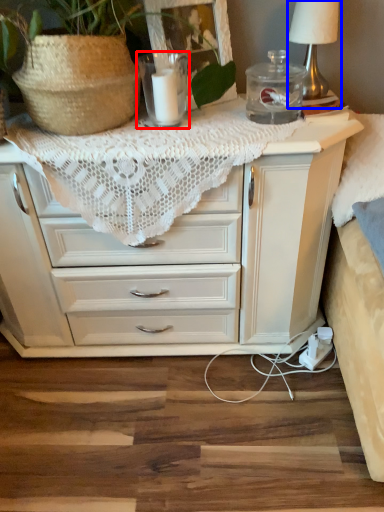
Question: Which object appears closest to the camera in this image, candle holder (highlighted by a red box) or table lamp (highlighted by a blue box)?

Choices:
 (A) candle holder
 (B) table lamp

Answer: (A)